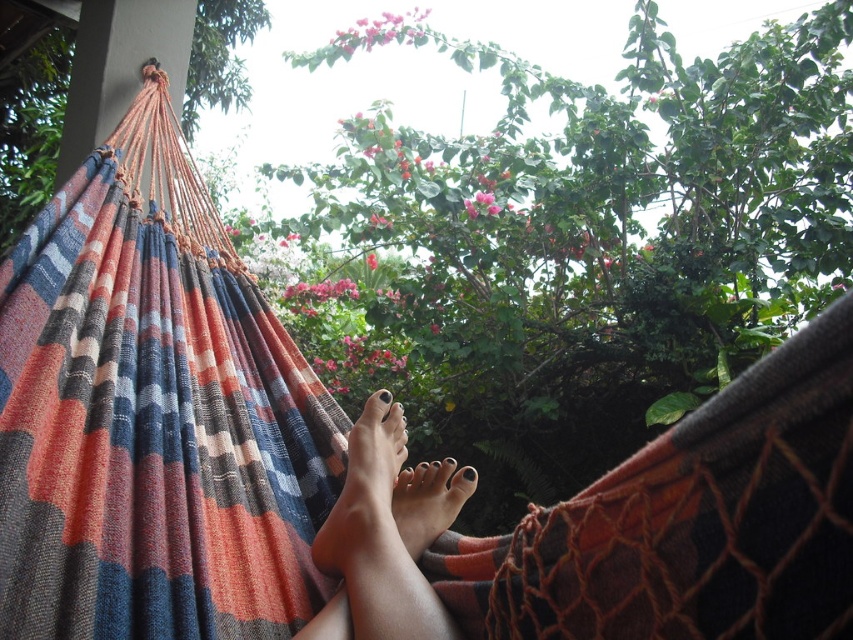
Is nail polish toes at center smaller than smooth skin foot at center?

No, nail polish toes at center is not smaller than smooth skin foot at center.

Can you confirm if nail polish toes at center is wider than smooth skin foot at center?

Indeed, nail polish toes at center has a greater width compared to smooth skin foot at center.

Between point (370, 452) and point (383, 397), which one is positioned in front?

Positioned in front is point (370, 452).

The height and width of the screenshot is (640, 853). What are the coordinates of `nail polish toes at center` in the screenshot? It's located at (386, 534).